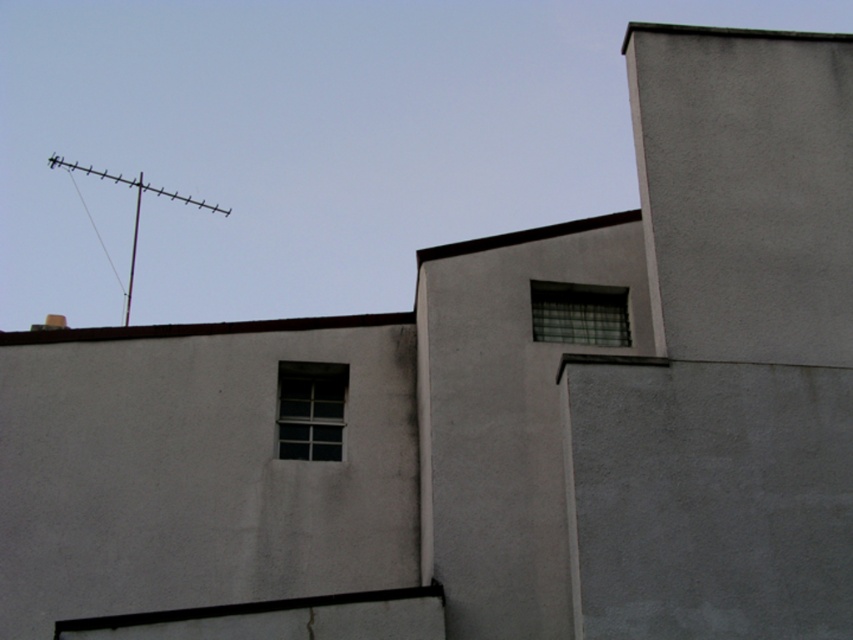
Does clear glass window at center appear on the left side of brown concrete roof at upper center?

No, clear glass window at center is not to the left of brown concrete roof at upper center.

Image resolution: width=853 pixels, height=640 pixels. What do you see at coordinates (310, 410) in the screenshot?
I see `clear glass window at center` at bounding box center [310, 410].

This screenshot has width=853, height=640. I want to click on clear glass window at center, so click(310, 410).

Does point (531, 284) come behind point (225, 211)?

No.

Does clear glass window at upper right appear over metallic antenna at upper left?

Incorrect, clear glass window at upper right is not positioned above metallic antenna at upper left.

Locate an element on the screen. The width and height of the screenshot is (853, 640). clear glass window at upper right is located at coordinates (579, 314).

Is clear glass window at center below clear glass window at upper right?

Yes, clear glass window at center is below clear glass window at upper right.

Can you confirm if clear glass window at center is shorter than clear glass window at upper right?

In fact, clear glass window at center may be taller than clear glass window at upper right.

This screenshot has height=640, width=853. I want to click on clear glass window at center, so click(x=310, y=410).

The image size is (853, 640). Identify the location of clear glass window at center. tap(310, 410).